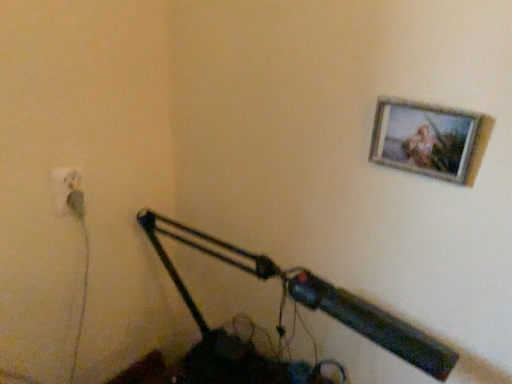
Question: From a real-world perspective, is white plastic electric outlet at lower left beneath wooden frame at upper right?

Choices:
 (A) yes
 (B) no

Answer: (A)

Question: Is wooden frame at upper right located within white plastic electric outlet at lower left?

Choices:
 (A) no
 (B) yes

Answer: (A)

Question: From the image's perspective, is white plastic electric outlet at lower left located beneath wooden frame at upper right?

Choices:
 (A) no
 (B) yes

Answer: (B)

Question: Considering the relative positions of white plastic electric outlet at lower left and wooden frame at upper right in the image provided, is white plastic electric outlet at lower left to the right of wooden frame at upper right from the viewer's perspective?

Choices:
 (A) no
 (B) yes

Answer: (A)

Question: Can you confirm if white plastic electric outlet at lower left is positioned to the left of wooden frame at upper right?

Choices:
 (A) no
 (B) yes

Answer: (B)

Question: Relative to white plastic electric outlet at lower left, is metallic black lamp at lower center in front or behind?

Choices:
 (A) behind
 (B) front

Answer: (B)

Question: Considering the relative positions of metallic black lamp at lower center and white plastic electric outlet at lower left in the image provided, is metallic black lamp at lower center to the left or to the right of white plastic electric outlet at lower left?

Choices:
 (A) right
 (B) left

Answer: (A)

Question: Looking at the image, does metallic black lamp at lower center seem bigger or smaller compared to white plastic electric outlet at lower left?

Choices:
 (A) small
 (B) big

Answer: (B)

Question: Is metallic black lamp at lower center spatially inside white plastic electric outlet at lower left, or outside of it?

Choices:
 (A) inside
 (B) outside

Answer: (B)

Question: Considering the positions of white plastic electric outlet at lower left and green rubber plug at lower left in the image, is white plastic electric outlet at lower left wider or thinner than green rubber plug at lower left?

Choices:
 (A) wide
 (B) thin

Answer: (B)

Question: From their relative heights in the image, would you say white plastic electric outlet at lower left is taller or shorter than green rubber plug at lower left?

Choices:
 (A) tall
 (B) short

Answer: (A)

Question: Would you say white plastic electric outlet at lower left is to the left or to the right of green rubber plug at lower left in the picture?

Choices:
 (A) left
 (B) right

Answer: (A)

Question: Relative to green rubber plug at lower left, is white plastic electric outlet at lower left in front or behind?

Choices:
 (A) front
 (B) behind

Answer: (A)

Question: Considering their positions, is wooden frame at upper right located in front of or behind green rubber plug at lower left?

Choices:
 (A) front
 (B) behind

Answer: (A)

Question: Is wooden frame at upper right inside or outside of green rubber plug at lower left?

Choices:
 (A) outside
 (B) inside

Answer: (A)